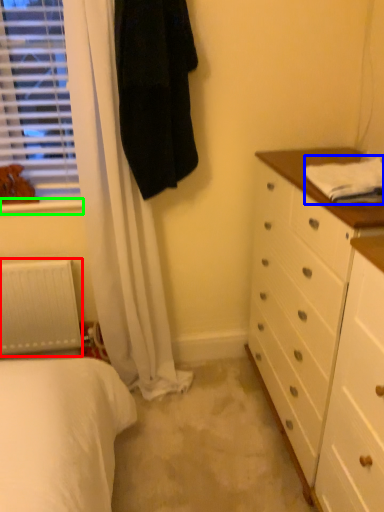
Question: Which object is positioned closest to radiator (highlighted by a red box)? Select from sheet (highlighted by a blue box) and window sill (highlighted by a green box).

Choices:
 (A) sheet
 (B) window sill

Answer: (B)